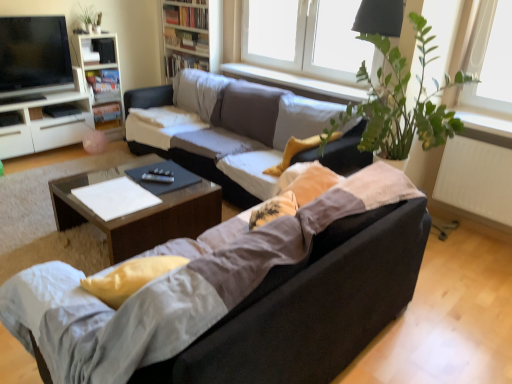
Question: Is the depth of white glossy cabinet at left greater than that of white plastic window at upper center?

Choices:
 (A) yes
 (B) no

Answer: (A)

Question: Is white glossy cabinet at left directly adjacent to white plastic window at upper center?

Choices:
 (A) yes
 (B) no

Answer: (B)

Question: From the image's perspective, would you say white glossy cabinet at left is positioned over white plastic window at upper center?

Choices:
 (A) no
 (B) yes

Answer: (A)

Question: Is white glossy cabinet at left taller than white plastic window at upper center?

Choices:
 (A) yes
 (B) no

Answer: (B)

Question: Considering the relative positions of white glossy cabinet at left and white plastic window at upper center in the image provided, is white glossy cabinet at left to the left of white plastic window at upper center from the viewer's perspective?

Choices:
 (A) no
 (B) yes

Answer: (B)

Question: Is white glossy bookshelf at upper left, the second bookshelf positioned from the right, inside or outside of wooden bookshelf at upper center, which is counted as the 2th bookshelf, starting from the left?

Choices:
 (A) outside
 (B) inside

Answer: (A)

Question: From the image's perspective, is white glossy bookshelf at upper left, the second bookshelf positioned from the right, above or below wooden bookshelf at upper center, which is the first bookshelf from right to left?

Choices:
 (A) below
 (B) above

Answer: (A)

Question: Based on their sizes in the image, would you say white glossy bookshelf at upper left, the second bookshelf positioned from the right, is bigger or smaller than wooden bookshelf at upper center, which is counted as the 2th bookshelf, starting from the left?

Choices:
 (A) big
 (B) small

Answer: (B)

Question: In the image, is white glossy bookshelf at upper left, the first bookshelf when ordered from left to right, positioned in front of or behind wooden bookshelf at upper center, which is the first bookshelf from right to left?

Choices:
 (A) front
 (B) behind

Answer: (A)

Question: Visually, is matte black tv at upper left positioned to the left or to the right of white smooth window sill at upper center?

Choices:
 (A) left
 (B) right

Answer: (A)

Question: From the image's perspective, is matte black tv at upper left located above or below white smooth window sill at upper center?

Choices:
 (A) above
 (B) below

Answer: (A)

Question: Is matte black tv at upper left wider or thinner than white smooth window sill at upper center?

Choices:
 (A) thin
 (B) wide

Answer: (A)

Question: Is point (28, 57) positioned closer to the camera than point (271, 84)?

Choices:
 (A) closer
 (B) farther

Answer: (A)

Question: Considering the positions of wooden bookshelf at upper center, which is the first bookshelf from right to left, and white glossy cabinet at left in the image, is wooden bookshelf at upper center, which is the first bookshelf from right to left, bigger or smaller than white glossy cabinet at left?

Choices:
 (A) small
 (B) big

Answer: (A)

Question: From the image's perspective, is wooden bookshelf at upper center, which is the first bookshelf from right to left, positioned above or below white glossy cabinet at left?

Choices:
 (A) below
 (B) above

Answer: (B)